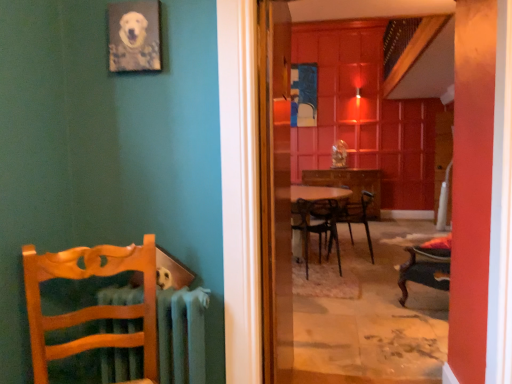
Question: From the image's perspective, is transparent glass screen door at center, which ranks as the first screen door in front-to-back order, above or below metallic black chair at center, positioned as the first chair in right-to-left order?

Choices:
 (A) below
 (B) above

Answer: (B)

Question: In the image, is transparent glass screen door at center, placed as the 2th screen door when sorted from back to front, positioned in front of or behind metallic black chair at center, which appears as the third chair when viewed from the front?

Choices:
 (A) behind
 (B) front

Answer: (B)

Question: Estimate the real-world distances between objects in this image. Which object is closer to the wooden picture frame at upper left?

Choices:
 (A) transparent glass screen door at center, which ranks as the first screen door in front-to-back order
 (B) metallic black chair at center, positioned as the first chair in right-to-left order
 (C) metallic radiator at left
 (D) wooden table at center
 (E) wooden chair at left, the first chair when ordered from front to back

Answer: (E)

Question: Considering the real-world distances, which object is closest to the wooden table at center?

Choices:
 (A) metallic radiator at left
 (B) wooden chair at center, arranged as the 2th chair when viewed from the right
 (C) transparent glass screen door at center, positioned as the second screen door in front-to-back order
 (D) transparent glass screen door at center, placed as the 2th screen door when sorted from back to front
 (E) wooden picture frame at upper left

Answer: (B)